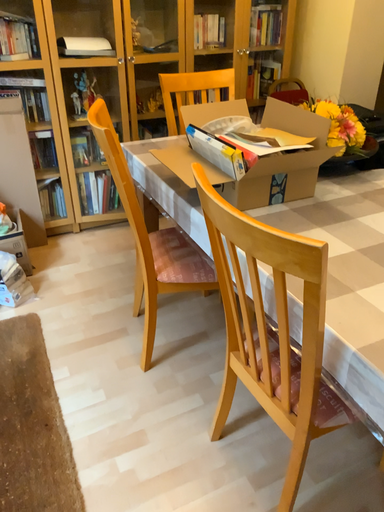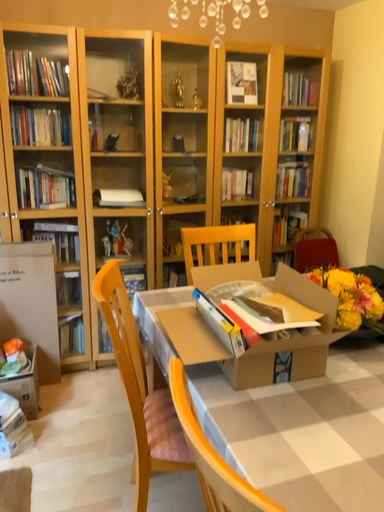
Question: Which way did the camera rotate in the video?

Choices:
 (A) rotated downward
 (B) rotated upward

Answer: (B)